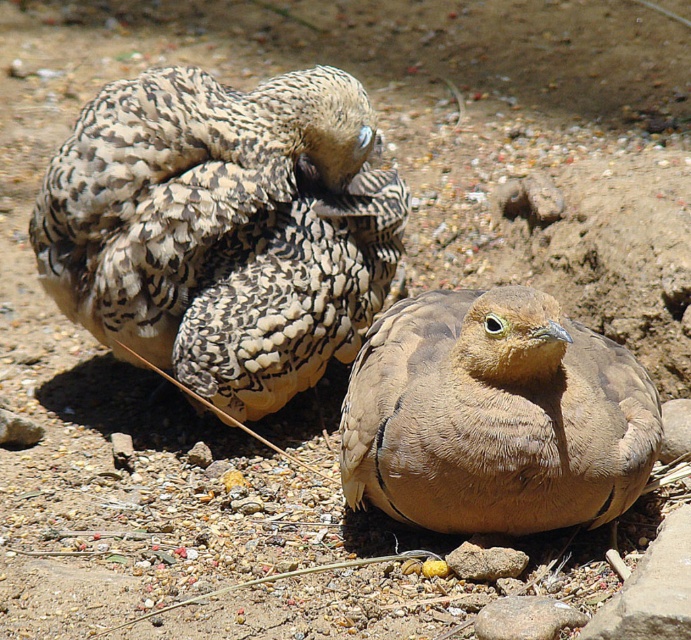
You are a photographer standing 3 meters away from the speckled feathers at center. Can you reach them without moving your feet?

The speckled feathers at center are 2.76 meters from viewer. Since you are standing 3 meters away, you cannot reach them without moving closer.

You are a birdwatcher observing two birds in the image. You notice a speckled feathers at center and a brown feathered bird at center. Which of these two is positioned higher in the image?

The speckled feathers at center is located above the brown feathered bird at center, so it is positioned higher in the image.